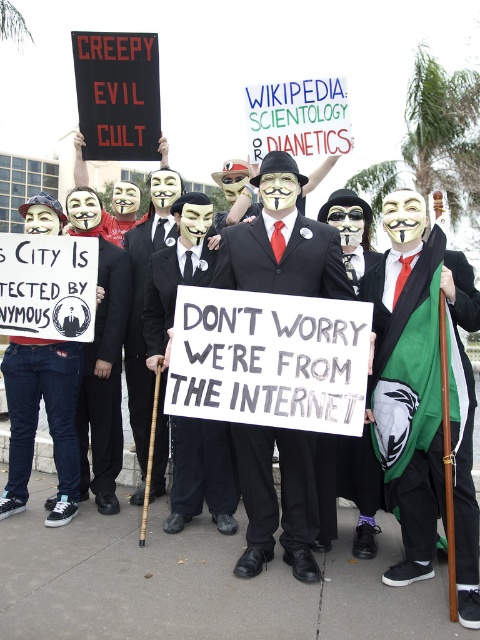
You are a photographer trying to capture the protest scene. You notice a person wearing a matte black suit at center and someone in denim jeans at lower left. Since you want to focus on the person closer to you, which one should you aim your camera at?

The matte black suit at center is closer to the viewer than the denim jeans at lower left, so you should aim your camera at the person wearing the matte black suit at center.

You are organizing a costume party and need to decide which outfit to wear. You have a matte black suit at center and denim jeans at lower left. Based on their sizes, which one might be more suitable if you prefer a slimmer fit?

The matte black suit at center has a smaller width than the denim jeans at lower left, making it more suitable for a slimmer fit.